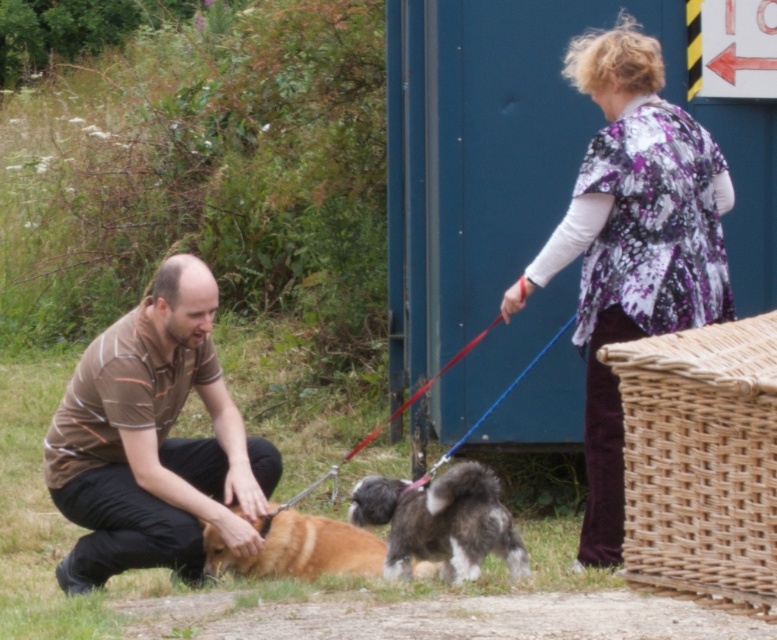
You are a photographer positioned to the right of the scene. You want to take a photo that includes both the brown striped shirt at lower left and the fluffy gray dog at center. Which object should you adjust your camera angle to ensure both are in frame?

The brown striped shirt at lower left is to the left of the fluffy gray dog at center. To include both in the frame, adjust the camera angle to the left to capture the brown striped shirt at lower left and the fluffy gray dog at center.